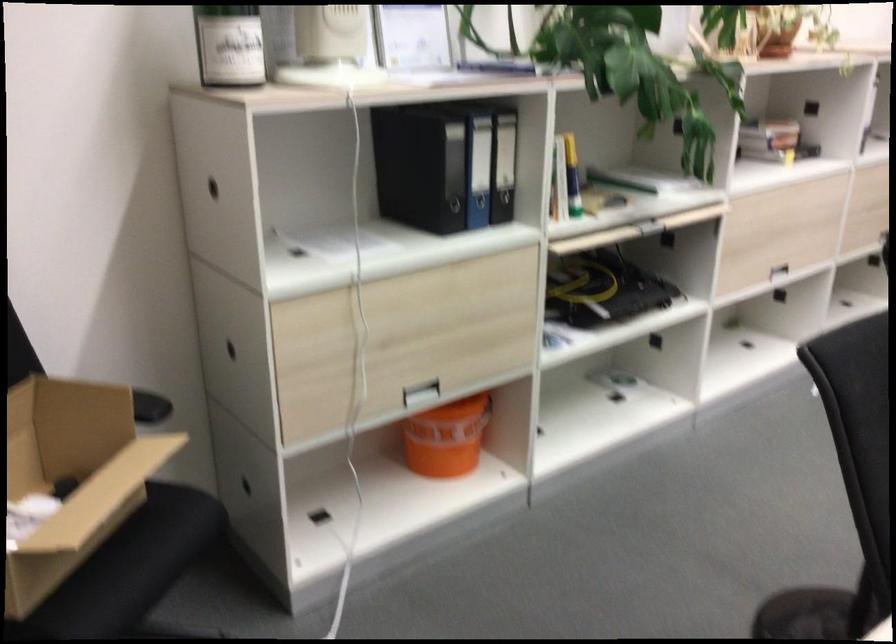
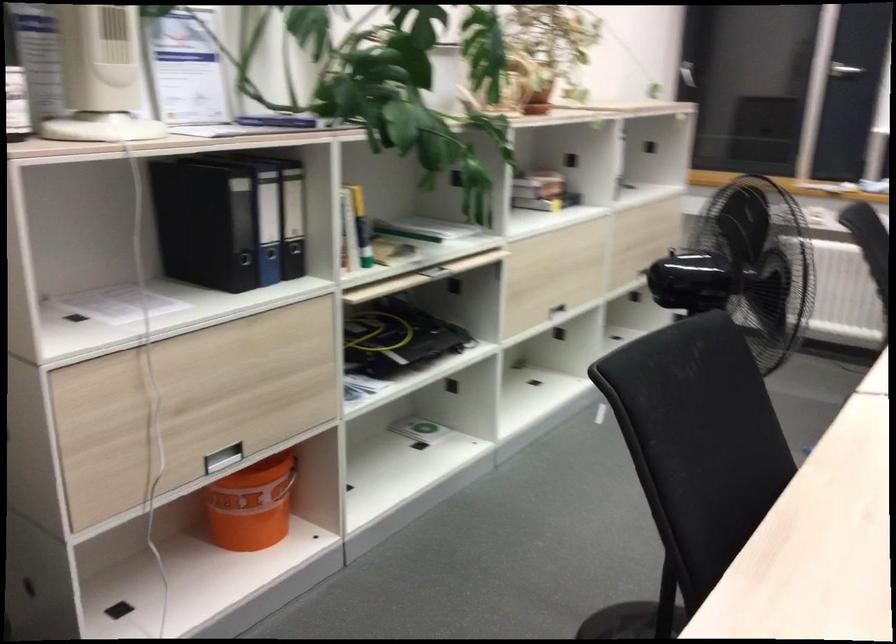
Question: How did the camera likely rotate?

Choices:
 (A) Left
 (B) Right
 (C) Up
 (D) Down

Answer: (B)